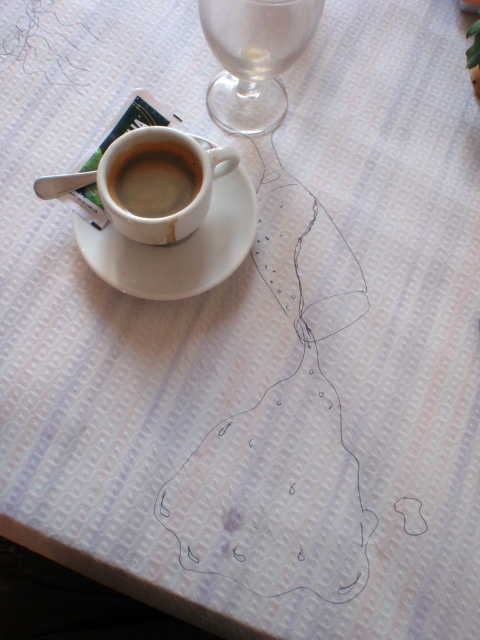
Question: Is white ceramic saucer at center to the right of matte ceramic cup at center from the viewer's perspective?

Choices:
 (A) yes
 (B) no

Answer: (A)

Question: Based on their relative distances, which object is farther from the transparent glass wine glass at upper right?

Choices:
 (A) matte ceramic cup at center
 (B) white ceramic saucer at center

Answer: (A)

Question: Can you confirm if transparent glass wine glass at upper right is smaller than white ceramic saucer at center?

Choices:
 (A) yes
 (B) no

Answer: (B)

Question: Which point is closer to the camera?

Choices:
 (A) matte ceramic cup at center
 (B) white ceramic saucer at center
 (C) transparent glass wine glass at upper right

Answer: (C)

Question: Estimate the real-world distances between objects in this image. Which object is farther from the white ceramic saucer at center?

Choices:
 (A) transparent glass wine glass at upper right
 (B) matte ceramic cup at center

Answer: (A)

Question: Does transparent glass wine glass at upper right lie in front of matte ceramic cup at center?

Choices:
 (A) yes
 (B) no

Answer: (A)